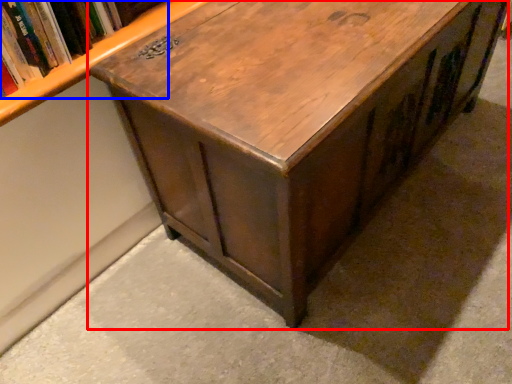
Question: Which object appears closest to the camera in this image, table (highlighted by a red box) or book (highlighted by a blue box)?

Choices:
 (A) table
 (B) book

Answer: (A)